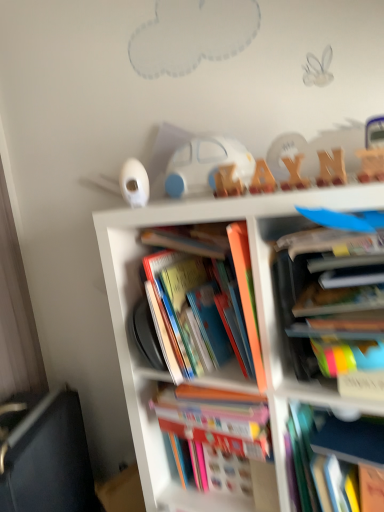
Locate an element on the screen. This screenshot has width=384, height=512. black fabric couch at lower left is located at coordinates (45, 455).

The height and width of the screenshot is (512, 384). What do you see at coordinates (318, 466) in the screenshot?
I see `hardcover book at center, marked as the fourth book in a top-to-bottom arrangement` at bounding box center [318, 466].

What is the approximate height of hardcover book at center, the second book from the top?

hardcover book at center, the second book from the top, is 12.44 inches in height.

Identify the location of multicolored cardboard books at center. This screenshot has width=384, height=512. (258, 321).

Find the location of `hardcover books at center, arranged as the 5th book when viewed from the top`. hardcover books at center, arranged as the 5th book when viewed from the top is located at coordinates (214, 424).

Locate an element on the screen. Image resolution: width=384 pixels, height=512 pixels. hardcover book at center, placed as the third book when sorted from bottom to top is located at coordinates (218, 258).

You are a GUI agent. You are given a task and a screenshot of the screen. Output one action in this format:
    pyautogui.click(x=<x>, y=<y>)
    Task: Click on the black fabric couch at lower left
    
    Given the screenshot: What is the action you would take?
    pyautogui.click(x=45, y=455)

Between multicolored paper book at center right, marked as the 1th book in a top-to-bottom arrangement, and multicolored cardboard books at center, which one has more height?

Standing taller between the two is multicolored cardboard books at center.

Is multicolored paper book at center right, marked as the 1th book in a top-to-bottom arrangement, facing towards multicolored cardboard books at center?

Yes, multicolored paper book at center right, marked as the 1th book in a top-to-bottom arrangement, is turned towards multicolored cardboard books at center.

Consider the image. Does multicolored paper book at center right, which ranks as the fifth book in bottom-to-top order, appear on the right side of multicolored cardboard books at center?

Indeed, multicolored paper book at center right, which ranks as the fifth book in bottom-to-top order, is positioned on the right side of multicolored cardboard books at center.

Which is behind, point (320, 334) or point (157, 463)?

The point (157, 463) is farther from the camera.

Does hardcover book at center, marked as the fourth book in a bottom-to-top arrangement, contain multicolored paper book at center right, which ranks as the fifth book in bottom-to-top order?

No, multicolored paper book at center right, which ranks as the fifth book in bottom-to-top order, is located outside of hardcover book at center, marked as the fourth book in a bottom-to-top arrangement.

Considering the sizes of objects hardcover book at center, the second book from the top, and multicolored paper book at center right, which ranks as the fifth book in bottom-to-top order, in the image provided, who is bigger, hardcover book at center, the second book from the top, or multicolored paper book at center right, which ranks as the fifth book in bottom-to-top order,?

Bigger between the two is multicolored paper book at center right, which ranks as the fifth book in bottom-to-top order.

Is there a large distance between hardcover book at center, the second book from the top, and multicolored paper book at center right, which ranks as the fifth book in bottom-to-top order?

No, hardcover book at center, the second book from the top, is not far from multicolored paper book at center right, which ranks as the fifth book in bottom-to-top order.

From the picture: Does black fabric couch at lower left have a greater height compared to hardcover books at center, arranged as the 5th book when viewed from the top?

Yes.

From the image's perspective, between black fabric couch at lower left and hardcover books at center, which is the 1th book in bottom-to-top order, who is located below?

black fabric couch at lower left.

From a real-world perspective, which is physically above, black fabric couch at lower left or hardcover books at center, arranged as the 5th book when viewed from the top?

From a 3D spatial view, hardcover books at center, arranged as the 5th book when viewed from the top, is above.

How many degrees apart are the facing directions of hardcover book at center, the 2th book positioned from the bottom, and multicolored cardboard books at center?

2.14 degrees.

Based on the photo, is hardcover book at center, the 2th book positioned from the bottom, spatially inside multicolored cardboard books at center, or outside of it?

hardcover book at center, the 2th book positioned from the bottom, is contained in multicolored cardboard books at center.

Is hardcover book at center, the 2th book positioned from the bottom, at the right side of multicolored cardboard books at center?

Correct, you'll find hardcover book at center, the 2th book positioned from the bottom, to the right of multicolored cardboard books at center.

Is hardcover book at center, marked as the fourth book in a top-to-bottom arrangement, far from multicolored cardboard books at center?

No, hardcover book at center, marked as the fourth book in a top-to-bottom arrangement, is in close proximity to multicolored cardboard books at center.

Considering the positions of objects hardcover book at center, the 2th book positioned from the bottom, and white plastic car at upper center in the image provided, who is more to the left, hardcover book at center, the 2th book positioned from the bottom, or white plastic car at upper center?

Positioned to the left is white plastic car at upper center.

From a real-world perspective, who is located higher, hardcover book at center, marked as the fourth book in a top-to-bottom arrangement, or white plastic car at upper center?

white plastic car at upper center, from a real-world perspective.

Does point (299, 459) come closer to viewer compared to point (190, 169)?

Yes.

Which object is wider, hardcover book at center, marked as the fourth book in a top-to-bottom arrangement, or white plastic car at upper center?

Wider between the two is hardcover book at center, marked as the fourth book in a top-to-bottom arrangement.

From the image's perspective, is multicolored paper book at center right, which ranks as the fifth book in bottom-to-top order, located above hardcover book at center, which appears as the third book when viewed from the top?

Yes, from the image's perspective, multicolored paper book at center right, which ranks as the fifth book in bottom-to-top order, is on top of hardcover book at center, which appears as the third book when viewed from the top.

Is multicolored paper book at center right, which ranks as the fifth book in bottom-to-top order, not close to hardcover book at center, which appears as the third book when viewed from the top?

No, multicolored paper book at center right, which ranks as the fifth book in bottom-to-top order, is not far away from hardcover book at center, which appears as the third book when viewed from the top.

Looking at this image, is multicolored paper book at center right, which ranks as the fifth book in bottom-to-top order, at the left side of hardcover book at center, which appears as the third book when viewed from the top?

In fact, multicolored paper book at center right, which ranks as the fifth book in bottom-to-top order, is to the right of hardcover book at center, which appears as the third book when viewed from the top.

Between point (378, 358) and point (257, 361), which one is positioned in front?

Positioned in front is point (378, 358).

Is white plastic car at upper center not inside hardcover book at center, the second book from the top?

That's correct, white plastic car at upper center is outside of hardcover book at center, the second book from the top.

Between white plastic car at upper center and hardcover book at center, the second book from the top, which one appears on the left side from the viewer's perspective?

white plastic car at upper center is more to the left.

In the scene shown: Which of these two, white plastic car at upper center or hardcover book at center, the second book from the top, is thinner?

Thinner between the two is white plastic car at upper center.

Does white plastic car at upper center turn towards hardcover book at center, the second book from the top?

No, white plastic car at upper center is not turned towards hardcover book at center, the second book from the top.

This screenshot has height=512, width=384. Find the location of `bookcase below the multicolored paper book at center right, marked as the 1th book in a top-to-bottom arrangement (from the image's perspective)`. bookcase below the multicolored paper book at center right, marked as the 1th book in a top-to-bottom arrangement (from the image's perspective) is located at coordinates (258, 321).

Where is `book that is the 1st object to the left of the multicolored paper book at center right, marked as the 1th book in a top-to-bottom arrangement, starting at the anchor`? The image size is (384, 512). book that is the 1st object to the left of the multicolored paper book at center right, marked as the 1th book in a top-to-bottom arrangement, starting at the anchor is located at coordinates (247, 294).

Considering their positions, is multicolored paper book at center right, marked as the 1th book in a top-to-bottom arrangement, positioned closer to white plastic car at upper center than hardcover book at center, which appears as the third book when viewed from the top?

Based on the image, hardcover book at center, which appears as the third book when viewed from the top, appears to be nearer to white plastic car at upper center.

When comparing their distances from hardcover books at center, which is the 1th book in bottom-to-top order, does multicolored cardboard books at center or hardcover book at center, marked as the fourth book in a bottom-to-top arrangement, seem further?

hardcover book at center, marked as the fourth book in a bottom-to-top arrangement, lies further to hardcover books at center, which is the 1th book in bottom-to-top order, than the other object.

When comparing their distances from multicolored paper book at center right, marked as the 1th book in a top-to-bottom arrangement, does white plastic car at upper center or hardcover book at center, placed as the third book when sorted from bottom to top, seem further?

Based on the image, white plastic car at upper center appears to be further to multicolored paper book at center right, marked as the 1th book in a top-to-bottom arrangement.

Looking at the image, which one is located further to hardcover book at center, marked as the fourth book in a top-to-bottom arrangement, multicolored cardboard books at center or hardcover book at center, marked as the fourth book in a bottom-to-top arrangement?

The object further to hardcover book at center, marked as the fourth book in a top-to-bottom arrangement, is multicolored cardboard books at center.

From the picture: Based on their spatial positions, is hardcover book at center, which appears as the third book when viewed from the top, or hardcover book at center, marked as the fourth book in a bottom-to-top arrangement, further from multicolored cardboard books at center?

hardcover book at center, marked as the fourth book in a bottom-to-top arrangement, is further to multicolored cardboard books at center.

Considering their positions, is multicolored paper book at center right, marked as the 1th book in a top-to-bottom arrangement, positioned further to hardcover book at center, marked as the fourth book in a top-to-bottom arrangement, than hardcover book at center, which appears as the third book when viewed from the top?

hardcover book at center, which appears as the third book when viewed from the top, is positioned further to the anchor hardcover book at center, marked as the fourth book in a top-to-bottom arrangement.

Considering their positions, is hardcover books at center, arranged as the 5th book when viewed from the top, positioned further to hardcover book at center, marked as the fourth book in a top-to-bottom arrangement, than multicolored cardboard books at center?

multicolored cardboard books at center is further to hardcover book at center, marked as the fourth book in a top-to-bottom arrangement.

Which object lies further to the anchor point white plastic car at upper center, hardcover book at center, marked as the fourth book in a top-to-bottom arrangement, or black fabric couch at lower left?

black fabric couch at lower left.

Find the location of `bookcase located between black fabric couch at lower left and hardcover book at center, the 2th book positioned from the bottom, in the left-right direction`. bookcase located between black fabric couch at lower left and hardcover book at center, the 2th book positioned from the bottom, in the left-right direction is located at coordinates (258, 321).

I want to click on book located between black fabric couch at lower left and hardcover books at center, which is the 1th book in bottom-to-top order, in the left-right direction, so click(218, 258).

Locate an element on the screen. This screenshot has height=512, width=384. bookcase located between hardcover books at center, which is the 1th book in bottom-to-top order, and hardcover book at center, the 2th book positioned from the bottom, in the left-right direction is located at coordinates (258, 321).

This screenshot has width=384, height=512. Find the location of `bookcase located between black fabric couch at lower left and multicolored paper book at center right, which ranks as the fifth book in bottom-to-top order, in the left-right direction`. bookcase located between black fabric couch at lower left and multicolored paper book at center right, which ranks as the fifth book in bottom-to-top order, in the left-right direction is located at coordinates (258, 321).